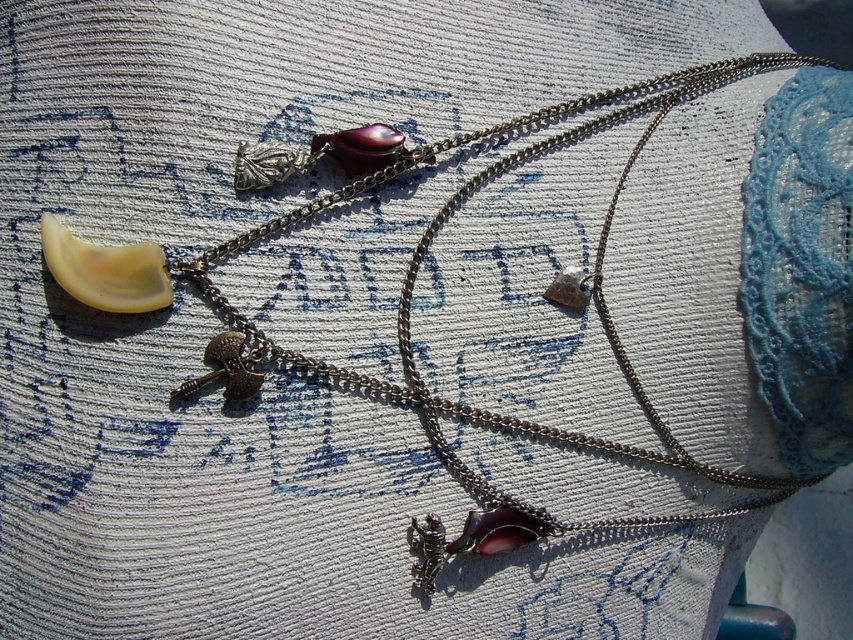
You are a jeweler trying to place both the gold metallic hammer at center and the matte silver charm at center into a display case. The case has a compartment that can only accommodate items up to 3 inches in width. Which item might not fit if the compartment is exactly 3 inches wide?

The gold metallic hammer at center might not fit in the compartment since it is wider than the matte silver charm at center, and the compartment can only hold items up to 3 inches wide.

You are organizing a jewelry display and need to place the gold metallic hammer at center and the matte silver charm at center in a specific order. According to the image, which object should be placed to the left side first?

Result: The gold metallic hammer at center should be placed to the left of the matte silver charm at center because it is positioned to the left in the image.

You are trying to decide which pendant to wear based on size. You have the gold metallic hammer at center and the matte silver charm at center. Which one is bigger?

The gold metallic hammer at center is larger in size than the matte silver charm at center.